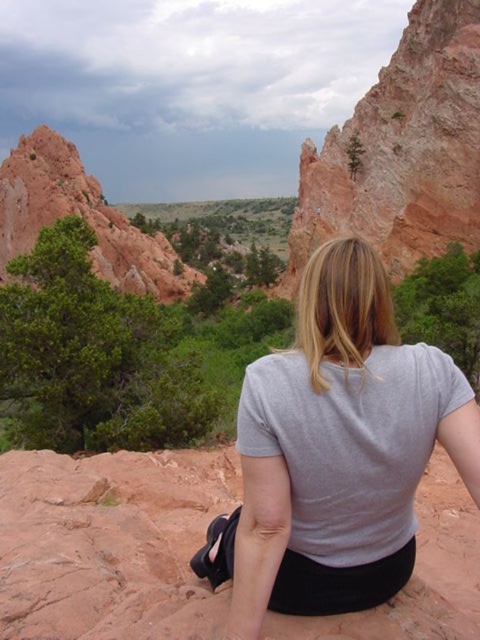
You are a photographer planning to capture the gray cotton shirt at center and the rustic sandstone cliff at upper right in a single frame. Based on their positions, which object should you focus on first to ensure both are in the frame without moving the camera?

The gray cotton shirt at center is located below the rustic sandstone cliff at upper right, so you should focus on the rustic sandstone cliff at upper right first to ensure both are in the frame without moving the camera.